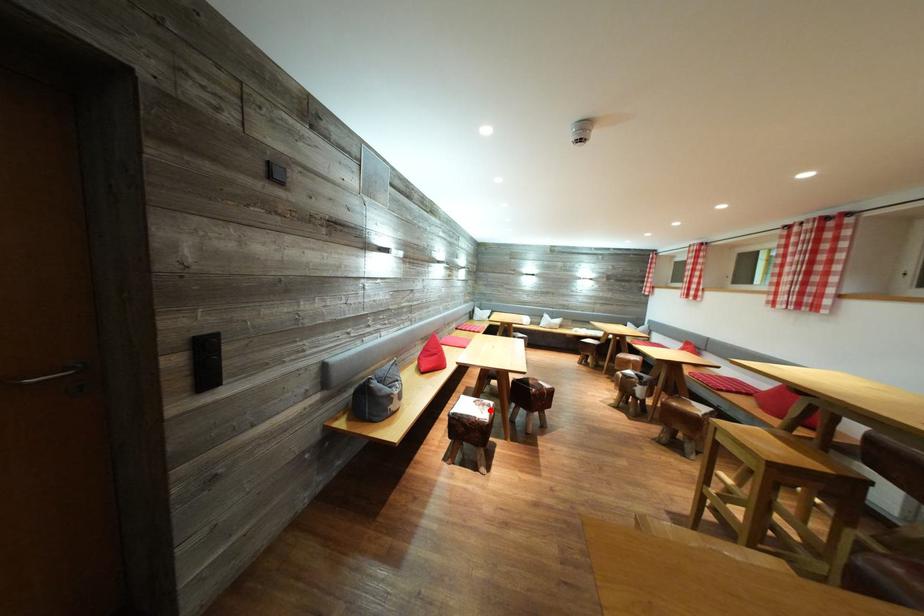
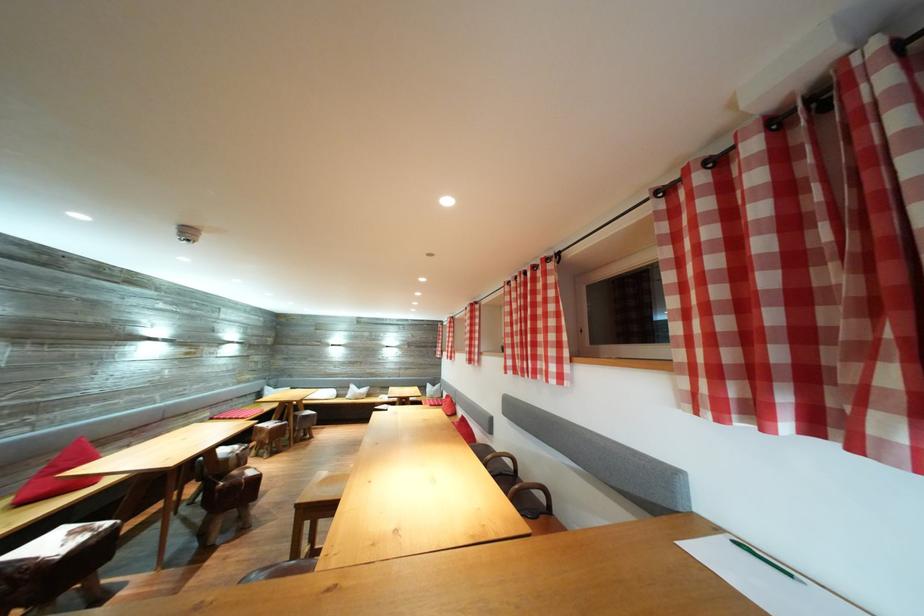
Question: A red point is marked in image1. In image2, is the corresponding 3D point closer to the camera or farther? Reply with the corresponding letter.

Choices:
 (A) The corresponding 3D point is closer.
 (B) The corresponding 3D point is farther.

Answer: (B)